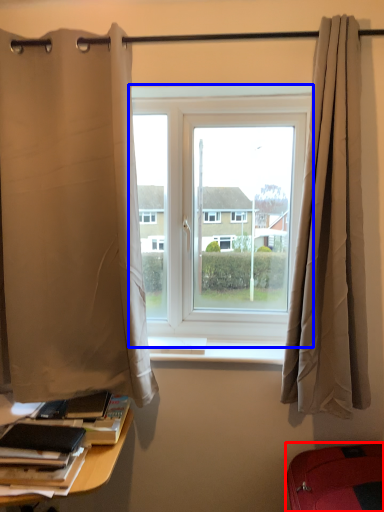
Question: Among these objects, which one is farthest to the camera, furniture (highlighted by a red box) or window (highlighted by a blue box)?

Choices:
 (A) furniture
 (B) window

Answer: (B)